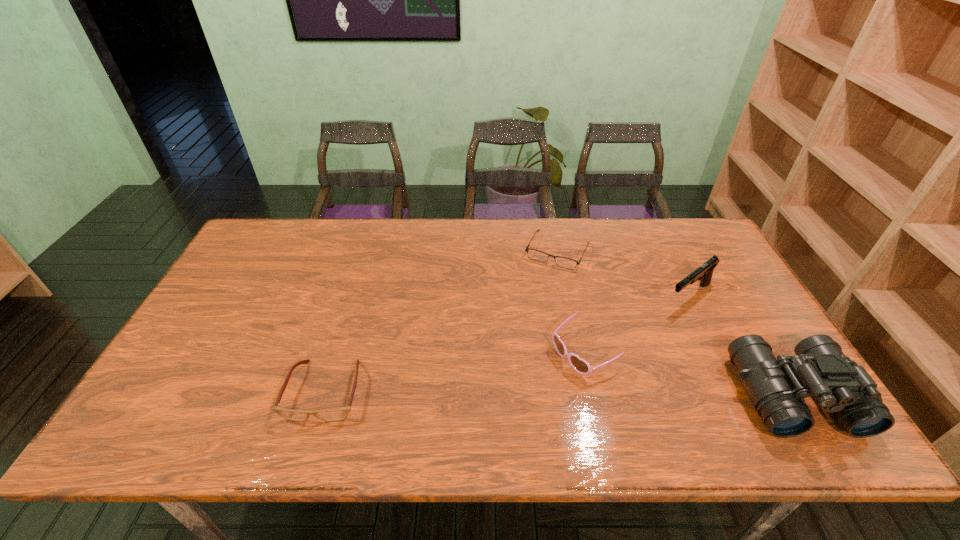
This screenshot has width=960, height=540. Identify the location of the fourth tallest object. (x=338, y=414).

Where is `the taller spectacles`? the taller spectacles is located at coordinates (338, 414).

I want to click on binoculars, so click(x=777, y=387).

In order to click on the fourth nearest object in this screenshot , I will do `click(704, 273)`.

Where is `the fourth shortest object`? This screenshot has height=540, width=960. the fourth shortest object is located at coordinates (704, 273).

Identify the location of the shorter spectacles. The width and height of the screenshot is (960, 540). (564, 262).

Identify the location of the farther spectacles. This screenshot has width=960, height=540. (564, 262).

Image resolution: width=960 pixels, height=540 pixels. Find the location of `sunglasses`. sunglasses is located at coordinates (581, 366).

Where is `free spot located 0.340m at the aiming end of the fourth shortest object`? The width and height of the screenshot is (960, 540). free spot located 0.340m at the aiming end of the fourth shortest object is located at coordinates (593, 368).

The height and width of the screenshot is (540, 960). I want to click on vacant space located 0.350m at the aiming end of the fourth shortest object, so [x=590, y=370].